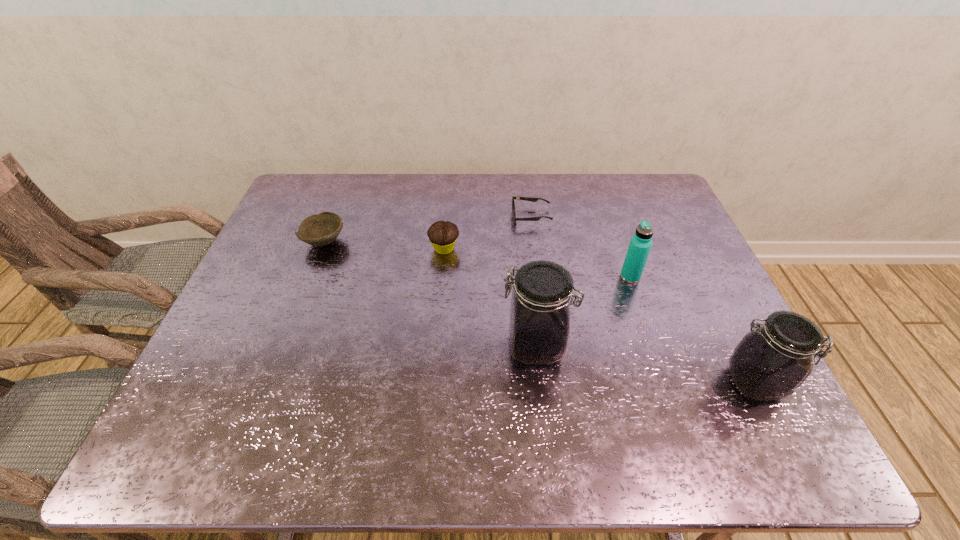
This screenshot has height=540, width=960. Identify the location of object that ranks as the fourth closest to the fifth object from right to left. (640, 245).

Locate an element on the screen. This screenshot has height=540, width=960. vacant space that satisfies the following two spatial constraints: 1. on the front side of the muffin; 2. on the left side of the second object from right to left is located at coordinates (442, 277).

This screenshot has width=960, height=540. I want to click on vacant space that satisfies the following two spatial constraints: 1. on the front side of the water bottle; 2. on the lid of the taller jar, so click(x=654, y=346).

The width and height of the screenshot is (960, 540). In order to click on free space that satisfies the following two spatial constraints: 1. on the front-facing side of the farthest object; 2. on the back side of the water bottle in this screenshot , I will do `click(540, 277)`.